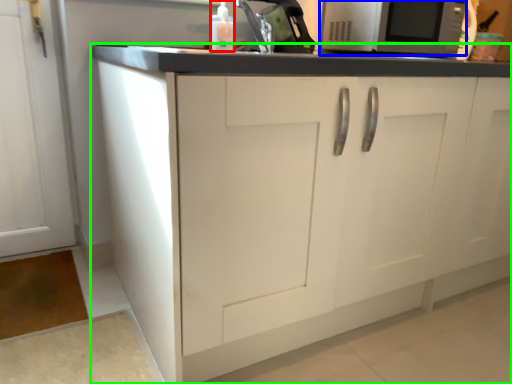
Question: Which object is positioned closest to bottle (highlighted by a red box)? Select from microwave oven (highlighted by a blue box) and cabinetry (highlighted by a green box).

Choices:
 (A) microwave oven
 (B) cabinetry

Answer: (A)